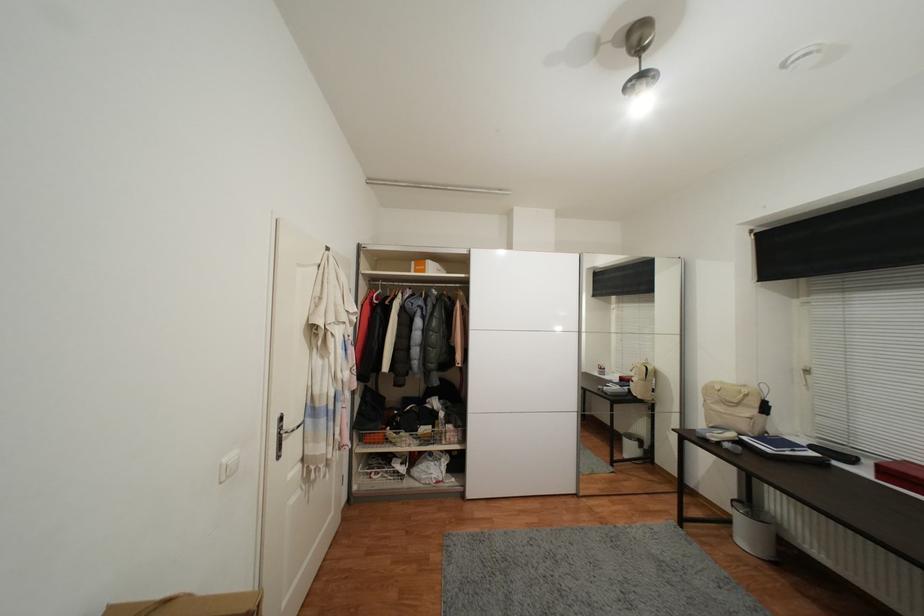
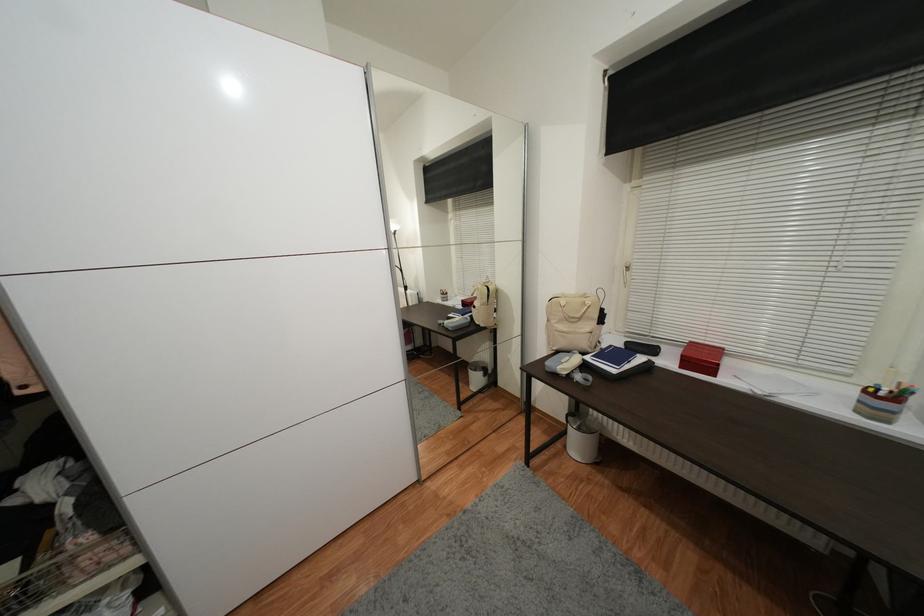
Where in the second image is the point corresponding to (x=748, y=439) from the first image?

(592, 360)